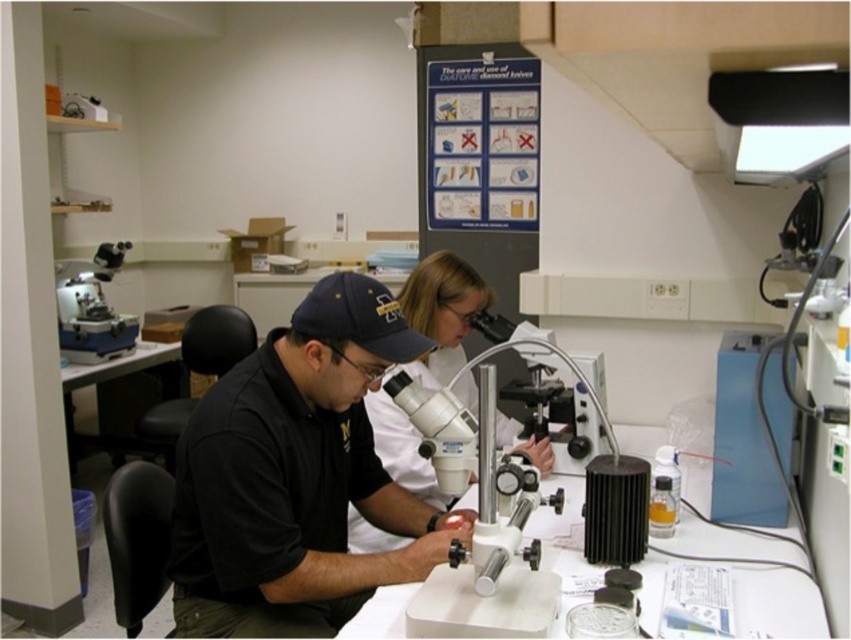
What do you see at coordinates (492, 554) in the screenshot? The width and height of the screenshot is (851, 640). I see `white plastic microscope at center` at bounding box center [492, 554].

Which is in front, point (430, 620) or point (438, 364)?

Point (430, 620) is more forward.

Where is `white plastic microscope at center`? The image size is (851, 640). white plastic microscope at center is located at coordinates (492, 554).

The width and height of the screenshot is (851, 640). Describe the element at coordinates (297, 477) in the screenshot. I see `black matte shirt at center` at that location.

Consider the image. Can you confirm if black matte shirt at center is positioned to the right of matte white microscope at upper left?

Correct, you'll find black matte shirt at center to the right of matte white microscope at upper left.

Who is more forward, (334, 502) or (73, 332)?

Point (334, 502) is more forward.

The height and width of the screenshot is (640, 851). Identify the location of black matte shirt at center. (297, 477).

Does black matte shirt at center have a larger size compared to matte white lab coat at center?

No, black matte shirt at center is not bigger than matte white lab coat at center.

Between point (191, 433) and point (398, 481), which one is positioned in front?

Positioned in front is point (191, 433).

The image size is (851, 640). In order to click on black matte shirt at center in this screenshot , I will do `click(297, 477)`.